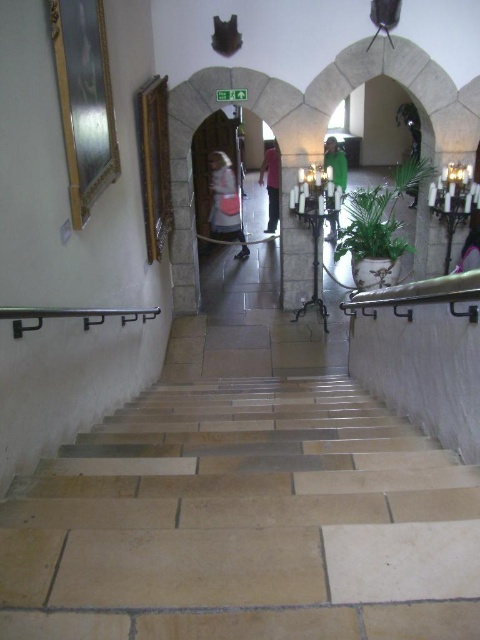
Question: Estimate the real-world distances between objects in this image. Which object is closer to the pink fabric dress at lower right?

Choices:
 (A) light brown stone stairs at center
 (B) light brown leather jacket at center

Answer: (B)

Question: Does green fabric at center have a smaller size compared to pink fabric dress at lower right?

Choices:
 (A) yes
 (B) no

Answer: (B)

Question: Can you confirm if light brown stone stairs at center is positioned to the right of green fabric at center?

Choices:
 (A) yes
 (B) no

Answer: (B)

Question: Is black polished metal handrail at lower left above pink fabric dress at lower right?

Choices:
 (A) no
 (B) yes

Answer: (A)

Question: Which point is farther from the camera taking this photo?

Choices:
 (A) (72, 554)
 (B) (336, 144)
 (C) (35, 308)

Answer: (B)

Question: Among these objects, which one is farthest from the camera?

Choices:
 (A) pink fabric dress at center
 (B) light brown stone stairs at center
 (C) pink fabric dress at lower right
 (D) light brown leather jacket at center

Answer: (A)